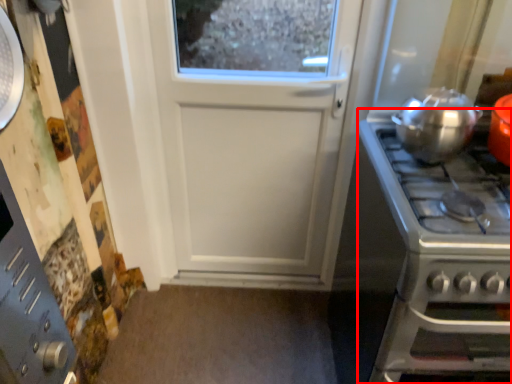
Question: Observing the image, what is the correct spatial positioning of gas stove (annotated by the red box) in reference to kitchen appliance?

Choices:
 (A) right
 (B) left

Answer: (A)